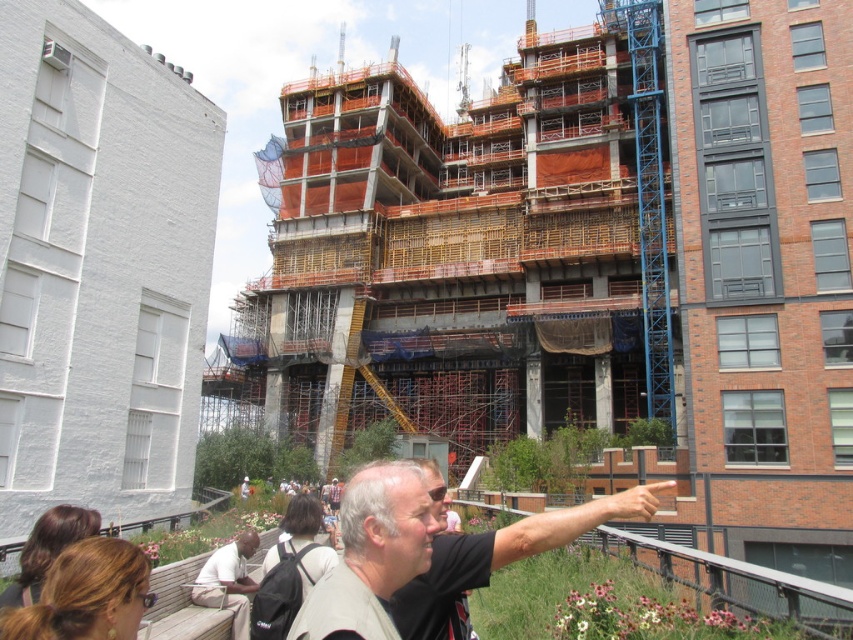
Does light beige shirt at center appear on the left side of light brown leather jacket at lower left?

Incorrect, light beige shirt at center is not on the left side of light brown leather jacket at lower left.

Can you confirm if light beige shirt at center is positioned below light brown leather jacket at lower left?

No.

Does point (366, 493) come behind point (219, 561)?

That is False.

The image size is (853, 640). Find the location of `light beige shirt at center`. light beige shirt at center is located at coordinates (370, 554).

Can you confirm if gray fabric shirt at center is positioned to the right of light beige shirt at center?

Yes, gray fabric shirt at center is to the right of light beige shirt at center.

Does point (595, 515) lie in front of point (335, 616)?

That is False.

Find the location of `gray fabric shirt at center`. gray fabric shirt at center is located at coordinates (496, 560).

Does gray fabric shirt at center come behind light brown leather jacket at lower left?

No, it is not.

Can you confirm if gray fabric shirt at center is taller than light brown leather jacket at lower left?

Yes.

Which is in front, point (585, 529) or point (242, 589)?

Point (585, 529) is more forward.

Where is `gray fabric shirt at center`? This screenshot has width=853, height=640. gray fabric shirt at center is located at coordinates (496, 560).